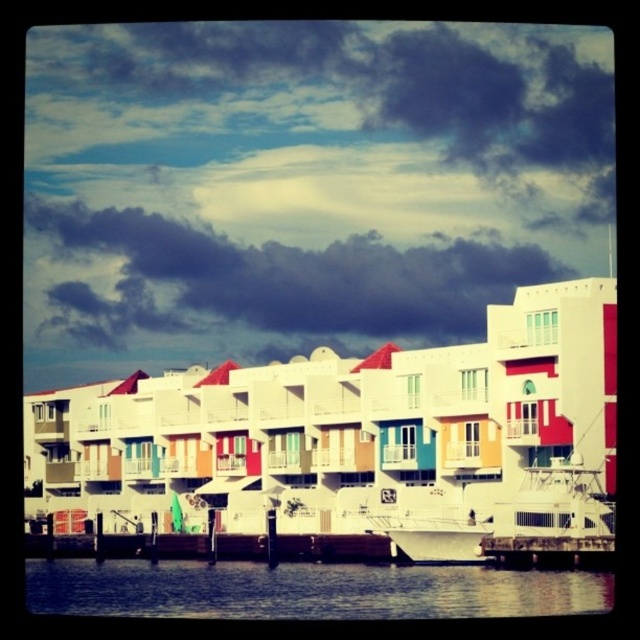
Looking at this image, which of these two, dark cloudy sky at upper center or wooden at lower center, stands shorter?

wooden at lower center

Consider the image. Is dark cloudy sky at upper center smaller than wooden at lower center?

No, dark cloudy sky at upper center is not smaller than wooden at lower center.

Which is behind, point (74, 310) or point (605, 566)?

The point (74, 310) is behind.

Where is `dark cloudy sky at upper center`? This screenshot has height=640, width=640. dark cloudy sky at upper center is located at coordinates (269, 280).

Does dark cloudy sky at upper center appear on the right side of blue water at lower center?

Correct, you'll find dark cloudy sky at upper center to the right of blue water at lower center.

Does dark cloudy sky at upper center come behind blue water at lower center?

That is True.

From the picture: Who is more distant from viewer, (492, 273) or (314, 582)?

Point (492, 273)

Locate an element on the screen. The image size is (640, 640). dark cloudy sky at upper center is located at coordinates (269, 280).

Between blue water at lower center and wooden at lower center, which one appears on the left side from the viewer's perspective?

blue water at lower center is more to the left.

Can you confirm if blue water at lower center is shorter than wooden at lower center?

In fact, blue water at lower center may be taller than wooden at lower center.

You are a GUI agent. You are given a task and a screenshot of the screen. Output one action in this format:
    pyautogui.click(x=<x>, y=<y>)
    Task: Click on the blue water at lower center
    
    Given the screenshot: What is the action you would take?
    pyautogui.click(x=307, y=589)